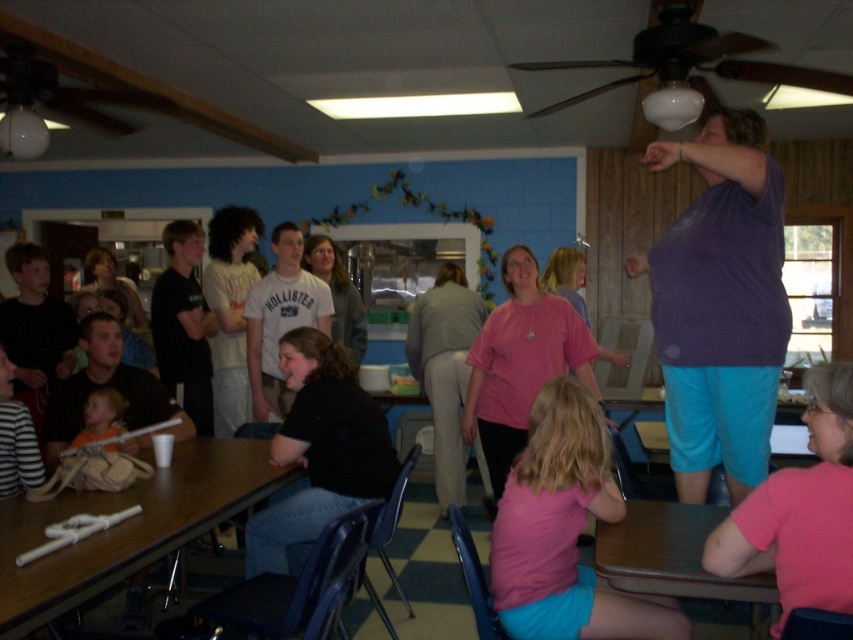
Does point (585, 576) lie in front of point (683, 524)?

That is True.

Is point (608, 460) positioned behind point (747, 586)?

Yes, point (608, 460) is farther from viewer.

Locate an element on the screen. pink matte shirt at lower center is located at coordinates (564, 531).

Is purple matte shirt at upper right positioned before matte orange shirt at lower left?

Yes, it is.

Identify the location of purple matte shirt at upper right. The height and width of the screenshot is (640, 853). (720, 305).

Does point (738, 474) come farther from viewer compared to point (80, 442)?

No.

The height and width of the screenshot is (640, 853). I want to click on purple matte shirt at upper right, so click(x=720, y=305).

Can you confirm if wooden table at center is positioned to the right of brown wood table at lower right?

Incorrect, wooden table at center is not on the right side of brown wood table at lower right.

Is point (228, 499) more distant than point (602, 538)?

Yes, it is.

The height and width of the screenshot is (640, 853). Identify the location of wooden table at center. (126, 528).